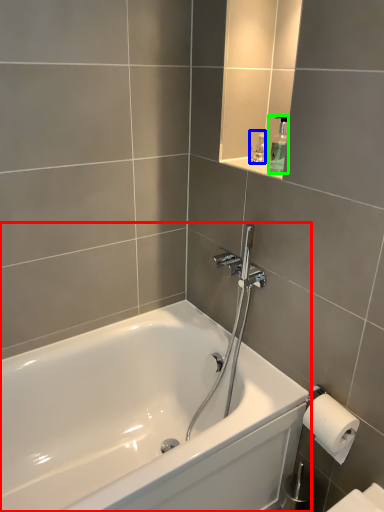
Question: Which object is the closest to the bathtub (highlighted by a red box)? Choose among these: toiletry (highlighted by a blue box) or soap dispenser (highlighted by a green box).

Choices:
 (A) toiletry
 (B) soap dispenser

Answer: (B)